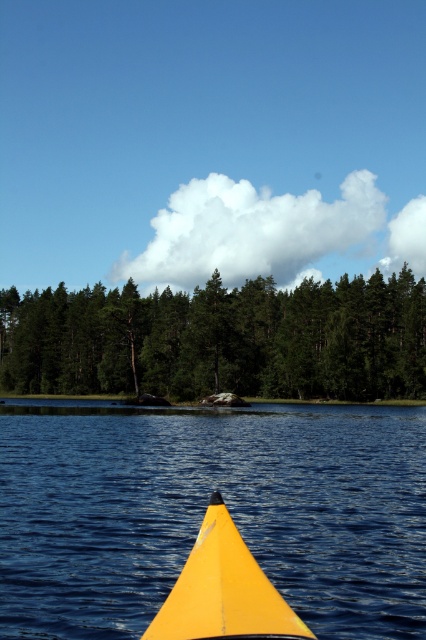
Question: Which is farther from the yellow plastic water at lower center?

Choices:
 (A) shiny yellow canoe at center
 (B) green matte trees at center

Answer: (B)

Question: Does green matte trees at center appear on the right side of shiny yellow canoe at center?

Choices:
 (A) no
 (B) yes

Answer: (A)

Question: Is yellow plastic water at lower center smaller than green matte trees at center?

Choices:
 (A) yes
 (B) no

Answer: (A)

Question: Does yellow plastic water at lower center have a smaller size compared to shiny yellow canoe at center?

Choices:
 (A) yes
 (B) no

Answer: (B)

Question: Which object is closer to the camera taking this photo?

Choices:
 (A) shiny yellow canoe at center
 (B) green matte trees at center

Answer: (A)

Question: Which of the following is the farthest from the observer?

Choices:
 (A) (419, 358)
 (B) (247, 598)

Answer: (A)